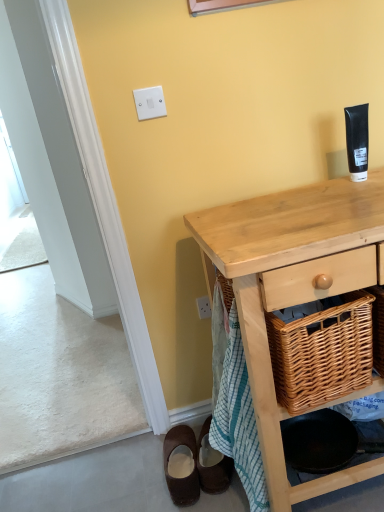
You are a GUI agent. You are given a task and a screenshot of the screen. Output one action in this format:
    pyautogui.click(x=<x>, y=<y>)
    Task: Click on the vacant space that is to the left of brown suede mule at lower left, arranged as the 1th footwear when viewed from the left
    
    Given the screenshot: What is the action you would take?
    pyautogui.click(x=132, y=495)